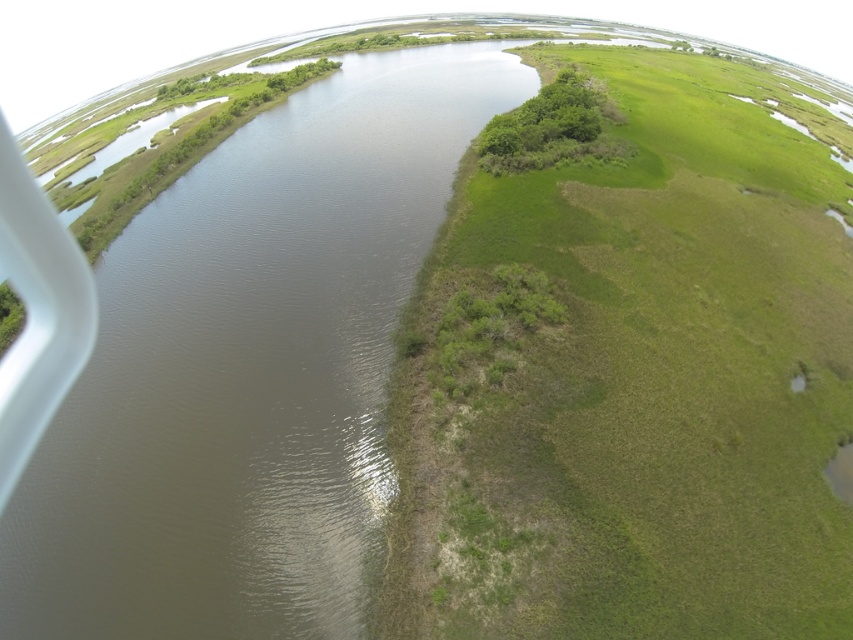
Question: Does brown muddy water at center have a lesser width compared to white plastic airplane window at left?

Choices:
 (A) no
 (B) yes

Answer: (A)

Question: In this image, where is green grassy patch at center-right located relative to white plastic airplane window at left?

Choices:
 (A) below
 (B) above

Answer: (B)

Question: Is brown muddy water at center positioned in front of white plastic airplane window at left?

Choices:
 (A) no
 (B) yes

Answer: (B)

Question: Which object appears farthest from the camera in this image?

Choices:
 (A) white plastic airplane window at left
 (B) brown muddy water at center

Answer: (A)

Question: Which point is closer to the camera?

Choices:
 (A) green grassy patch at center-right
 (B) white plastic airplane window at left

Answer: (A)

Question: Which point is closer to the camera taking this photo?

Choices:
 (A) (7, 388)
 (B) (689, 218)
 (C) (22, 588)

Answer: (C)